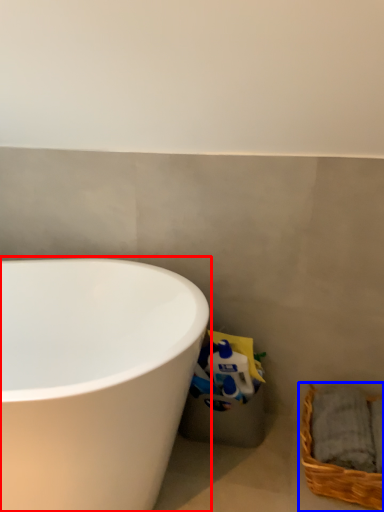
Question: Which point is further to the camera, bathtub (highlighted by a red box) or picnic basket (highlighted by a blue box)?

Choices:
 (A) bathtub
 (B) picnic basket

Answer: (B)